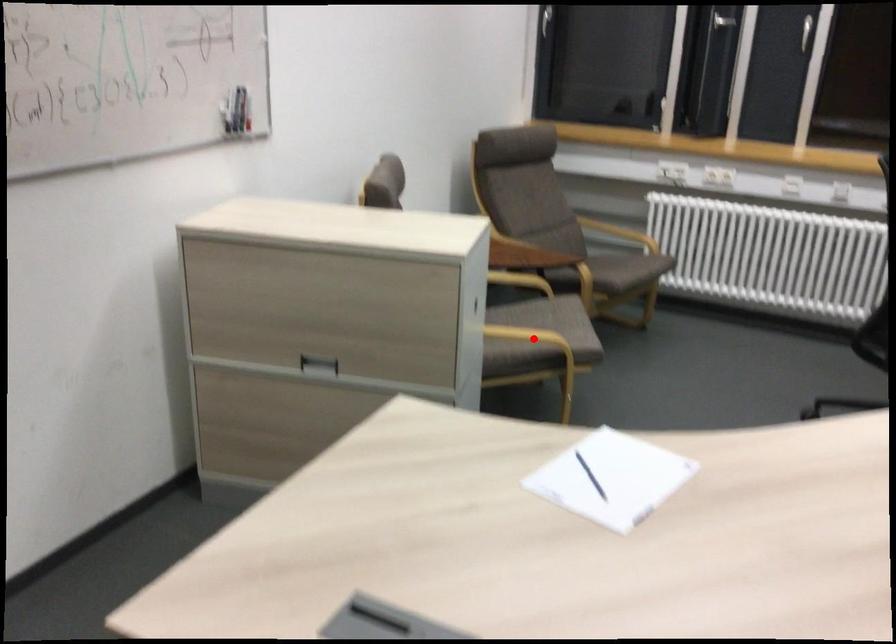
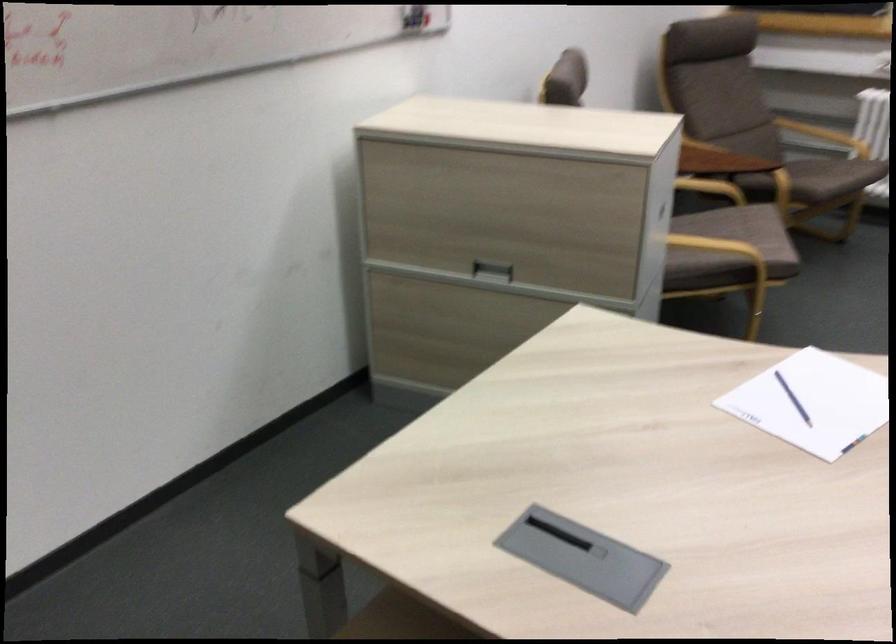
Find the pixel in the second image that matches the highlighted location in the first image.

(721, 249)